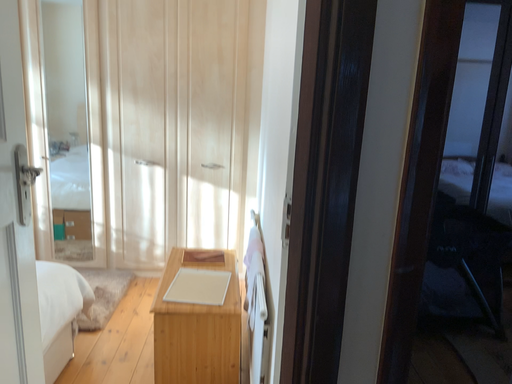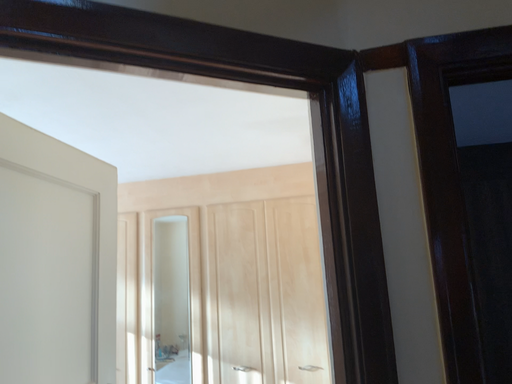
Question: How did the camera likely rotate when shooting the video?

Choices:
 (A) rotated upward
 (B) rotated downward

Answer: (A)